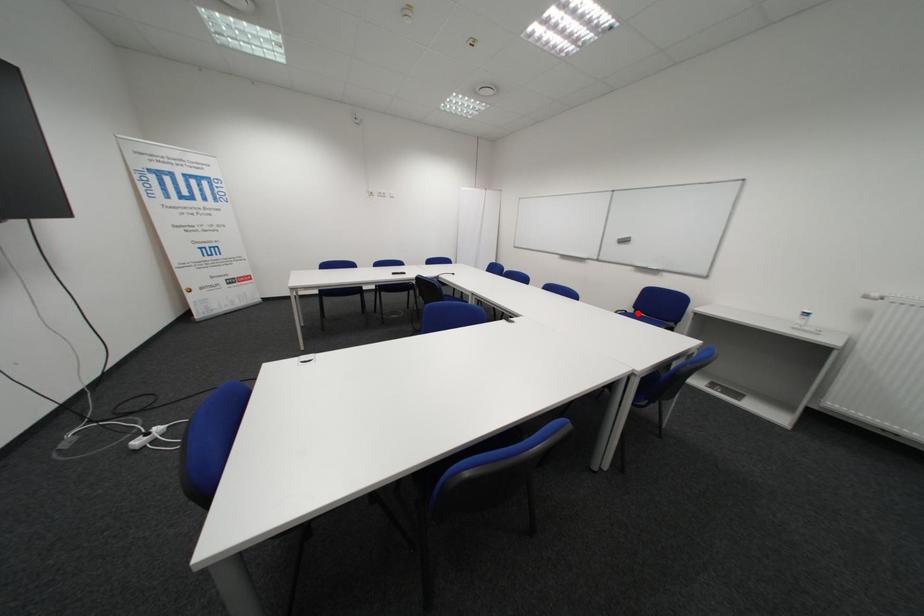
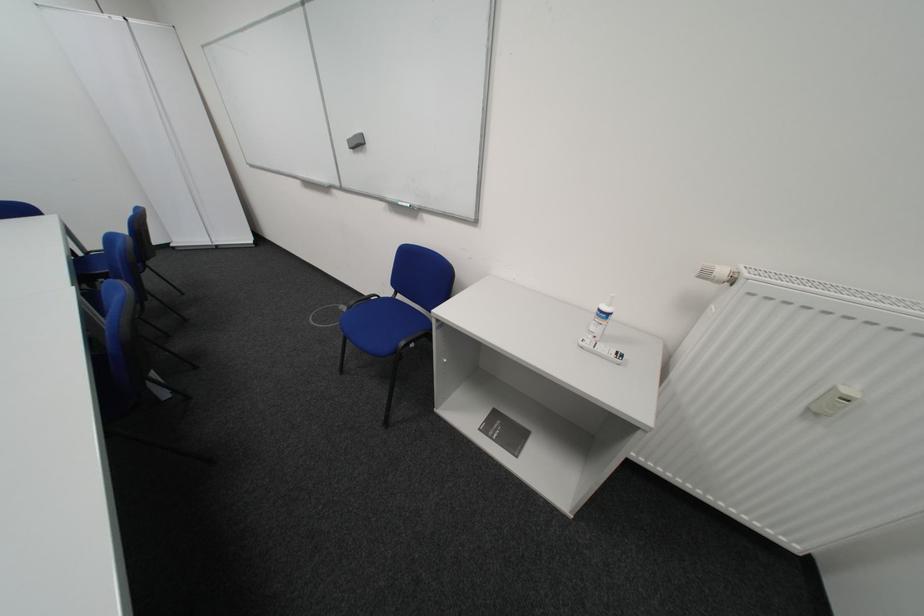
Question: I am providing you with two images of the same scene from different viewpoints. Given a red point in image1, look at the same physical point in image2. Is it:

Choices:
 (A) Closer to the viewpoint
 (B) Farther from the viewpoint

Answer: (A)